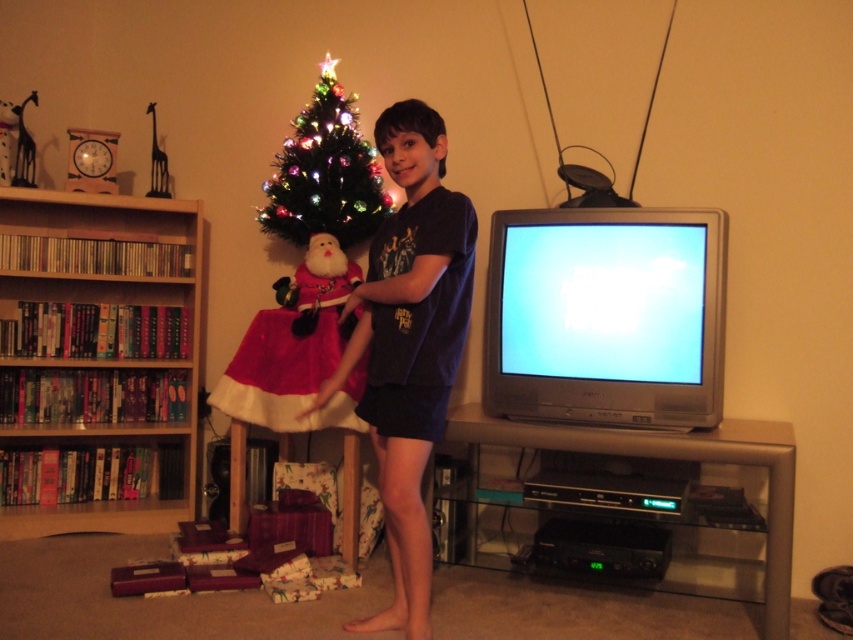
From the picture: Who is positioned more to the left, velvet santa at center or multicolored lights christmas tree at center?

Positioned to the left is velvet santa at center.

Does velvet santa at center appear under multicolored lights christmas tree at center?

Correct, velvet santa at center is located below multicolored lights christmas tree at center.

Who is more distant from viewer, (277,401) or (318,188)?

The point (318,188) is more distant.

The height and width of the screenshot is (640, 853). Identify the location of velvet santa at center. (296, 353).

Which is below, wooden bookshelf at left or multicolored lights christmas tree at center?

wooden bookshelf at left is below.

Is wooden bookshelf at left behind multicolored lights christmas tree at center?

Yes, it is.

Find the location of `wooden bookshelf at left`. wooden bookshelf at left is located at coordinates (103, 364).

Which of these two, wooden bookshelf at left or velvet santa at center, stands shorter?

With less height is velvet santa at center.

Is point (114, 445) farther from camera compared to point (355, 376)?

Yes, it is.

Is point (90, 301) positioned after point (303, 420)?

That is True.

Where is `wooden bookshelf at left`? wooden bookshelf at left is located at coordinates (103, 364).